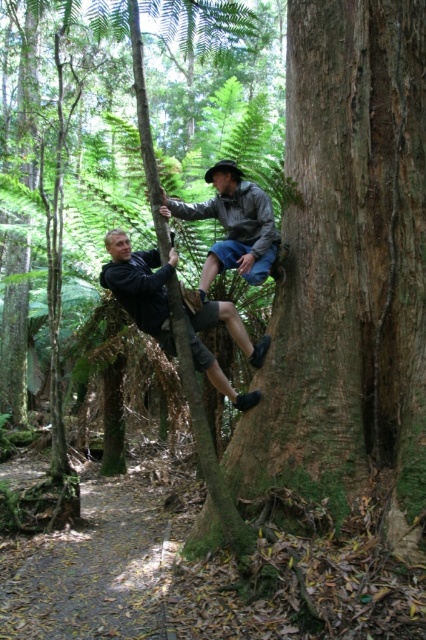
Question: Based on their relative distances, which object is nearer to the green mossy tree trunk at center?

Choices:
 (A) gray fabric jacket at center
 (B) matte black jacket at left

Answer: (A)

Question: Which point is farther to the camera?

Choices:
 (A) green mossy tree trunk at center
 (B) matte black jacket at left

Answer: (B)

Question: Is green mossy tree trunk at center bigger than matte black jacket at left?

Choices:
 (A) yes
 (B) no

Answer: (A)

Question: Which point is farther to the camera?

Choices:
 (A) green mossy tree trunk at center
 (B) gray fabric jacket at center

Answer: (B)

Question: Does matte black jacket at left lie in front of gray fabric jacket at center?

Choices:
 (A) yes
 (B) no

Answer: (A)

Question: Can you confirm if matte black jacket at left is positioned to the right of gray fabric jacket at center?

Choices:
 (A) no
 (B) yes

Answer: (A)